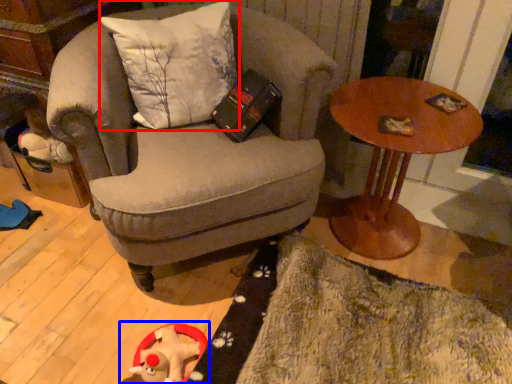
Question: Which object is closer to the camera taking this photo, pillow (highlighted by a red box) or toy (highlighted by a blue box)?

Choices:
 (A) pillow
 (B) toy

Answer: (A)